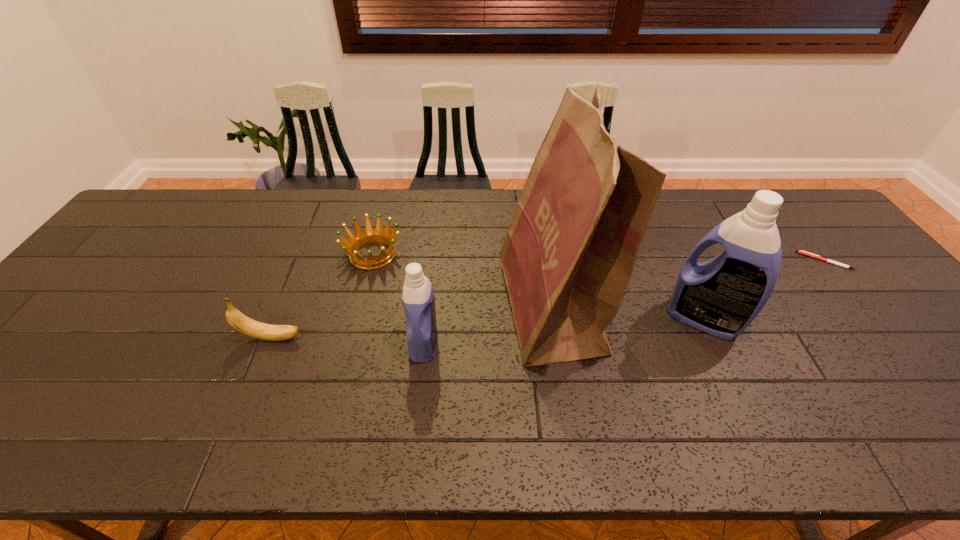
This screenshot has height=540, width=960. Find the location of `the fourth object from left to right`. the fourth object from left to right is located at coordinates (567, 258).

The image size is (960, 540). In order to click on the tallest object in this screenshot , I will do `click(567, 258)`.

Image resolution: width=960 pixels, height=540 pixels. I want to click on vacant position located on the right of the shorter detergent, so click(x=475, y=342).

Where is `vacant space located on the right of the taller detergent`? vacant space located on the right of the taller detergent is located at coordinates (858, 319).

Image resolution: width=960 pixels, height=540 pixels. In order to click on free location located on the front of the crown in this screenshot , I will do `click(334, 406)`.

Find the location of a particular element. free space located on the clicker of the rightmost object is located at coordinates (750, 261).

Where is `free location located on the clicker of the rightmost object`? The width and height of the screenshot is (960, 540). free location located on the clicker of the rightmost object is located at coordinates (778, 261).

Find the location of a particular element. The height and width of the screenshot is (540, 960). vacant space situated 0.080m on the clicker of the rightmost object is located at coordinates (774, 261).

Where is `blank space located 0.360m at the start of the peel on the leftmost object`? The width and height of the screenshot is (960, 540). blank space located 0.360m at the start of the peel on the leftmost object is located at coordinates (451, 338).

Find the location of a particular element. vacant space located on the front-facing side of the tallest object is located at coordinates point(455,308).